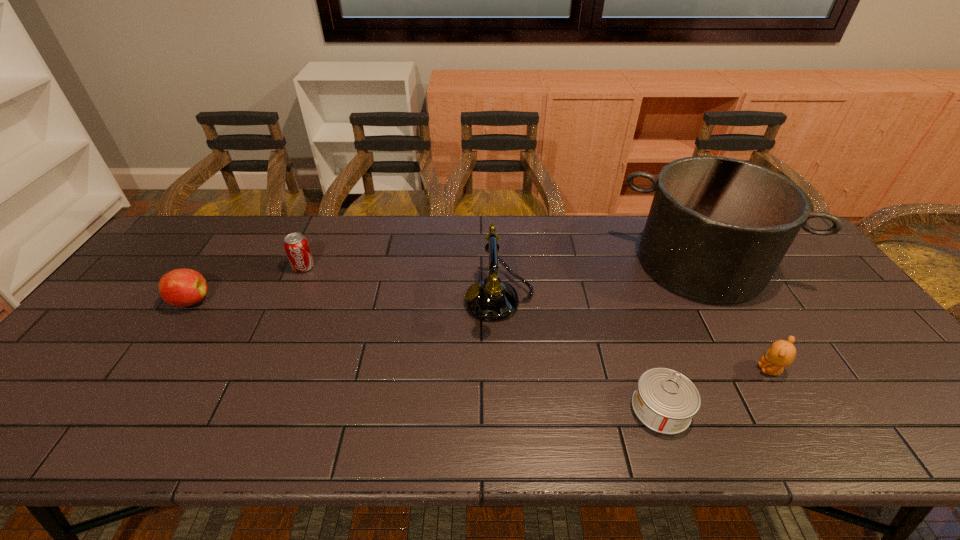
Locate an element on the screen. This screenshot has height=540, width=960. the tallest object is located at coordinates (718, 228).

I want to click on the fifth shortest object, so click(491, 299).

What are the coordinates of `the fourth object from right to left` in the screenshot? It's located at (491, 299).

Image resolution: width=960 pixels, height=540 pixels. I want to click on the second object from left to right, so click(x=296, y=246).

Where is `the second nearest object`? The image size is (960, 540). the second nearest object is located at coordinates (781, 353).

Identify the location of apple. tap(181, 287).

This screenshot has width=960, height=540. I want to click on the nearest object, so click(665, 400).

At what (x,y) coordinates should I click in order to perform the action: click on can. Please return your answer as a coordinate pair (x, y). The width and height of the screenshot is (960, 540). Looking at the image, I should click on (665, 400).

Locate an element on the screen. The image size is (960, 540). free location located 0.230m on the front of the tallest object is located at coordinates (765, 379).

Locate an element on the screen. This screenshot has height=540, width=960. free space located 0.180m on the dial of the telephone is located at coordinates (400, 300).